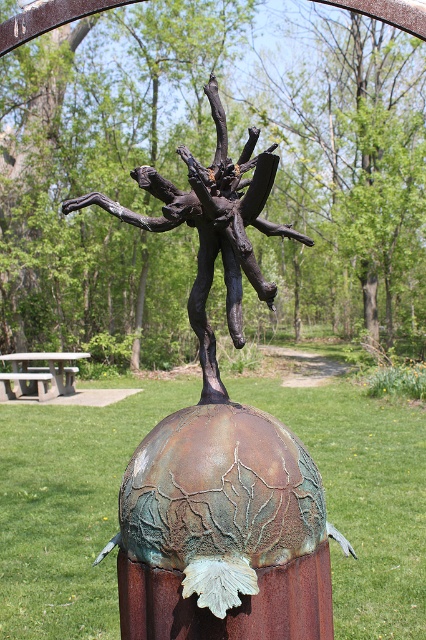
Is point (282, 522) positioned behind point (6, 397)?

No.

Who is positioned more to the right, rusty metal sculpture at center or gray concrete picnic table at lower left?

Positioned to the right is rusty metal sculpture at center.

Identify the location of rusty metal sculpture at center. (219, 449).